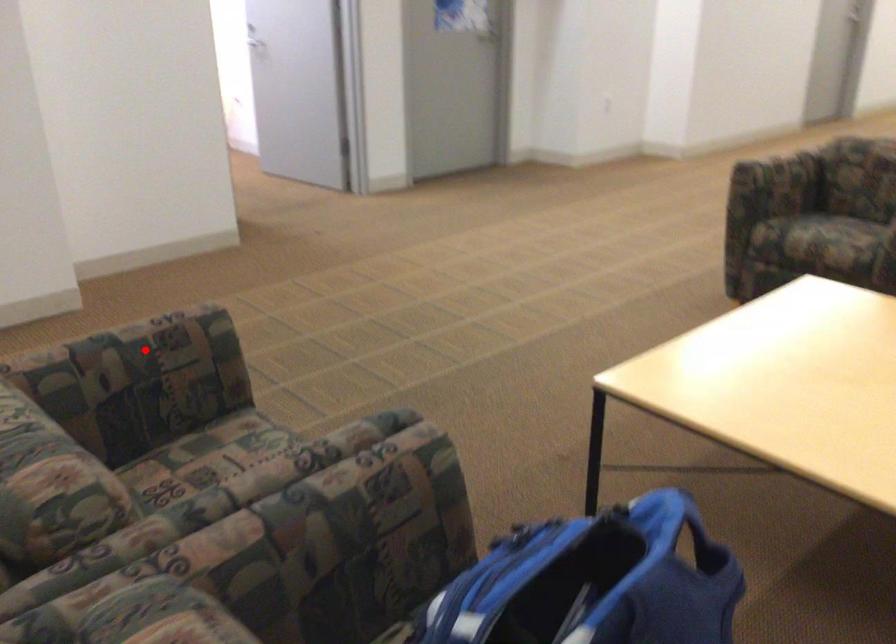
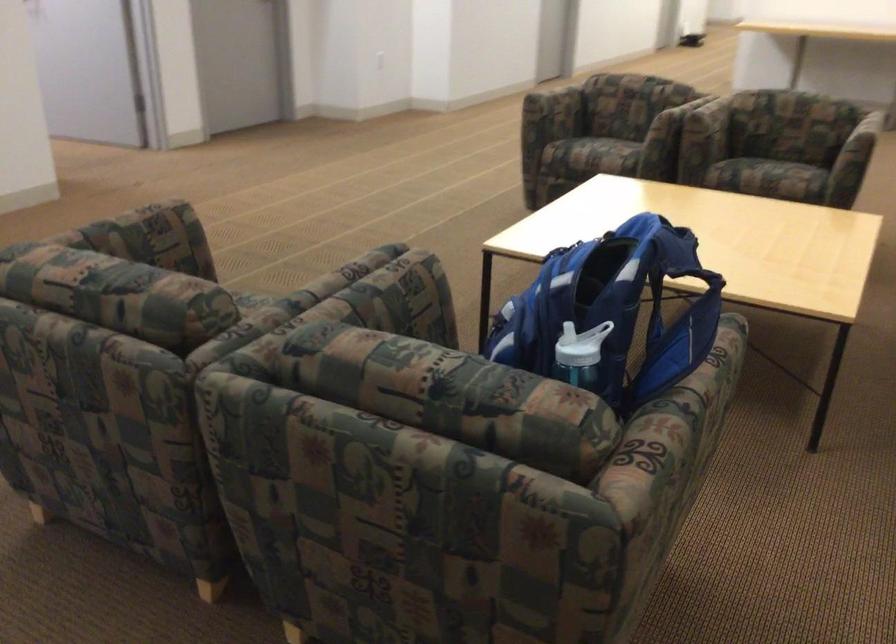
The point at the highlighted location is marked in the first image. Where is the corresponding point in the second image?

(141, 232)